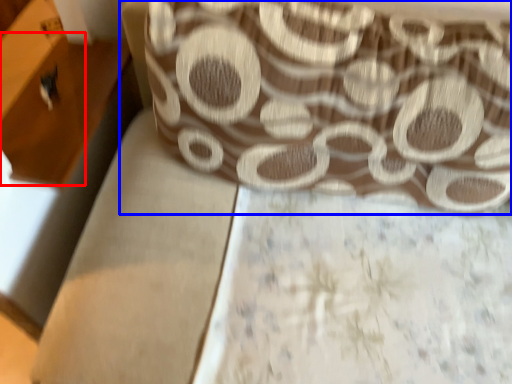
Question: Which point is further to the camera, drawer (highlighted by a red box) or curtain (highlighted by a blue box)?

Choices:
 (A) drawer
 (B) curtain

Answer: (A)